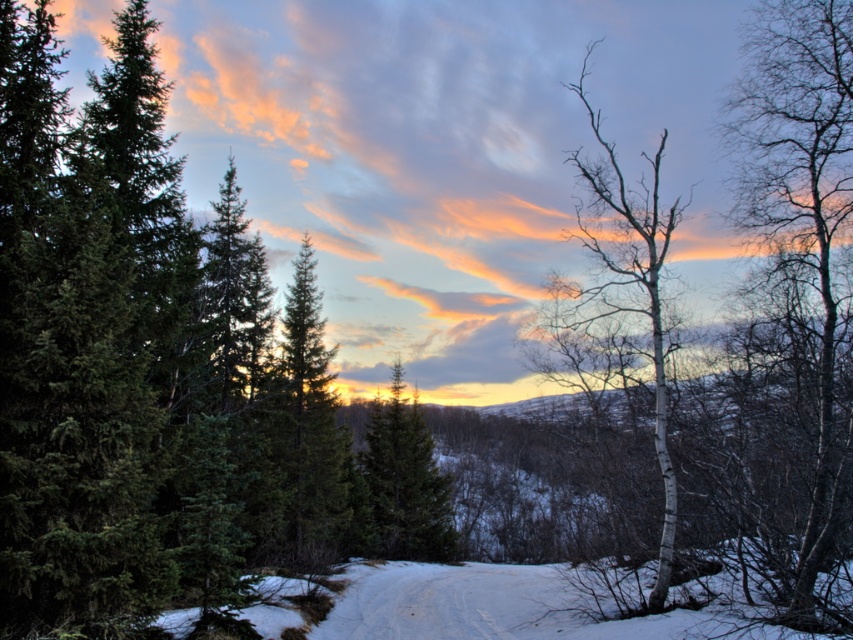
Question: Which of the following is the farthest from the observer?

Choices:
 (A) (328, 515)
 (B) (398, 556)
 (C) (631, 241)

Answer: (B)

Question: Which of these objects is positioned closest to the white bark tree at right?

Choices:
 (A) bare wood tree at right
 (B) green matte tree at center

Answer: (A)

Question: Is bare wood tree at right bigger than green matte tree at center?

Choices:
 (A) yes
 (B) no

Answer: (B)

Question: Is bare wood tree at right below green matte evergreen tree at center?

Choices:
 (A) no
 (B) yes

Answer: (A)

Question: Among these points, which one is farthest from the camera?

Choices:
 (A) (271, 509)
 (B) (828, 250)
 (C) (656, 177)
 (D) (407, 496)

Answer: (D)

Question: In this image, where is bare wood tree at right located relative to white bark tree at right?

Choices:
 (A) right
 (B) left

Answer: (B)